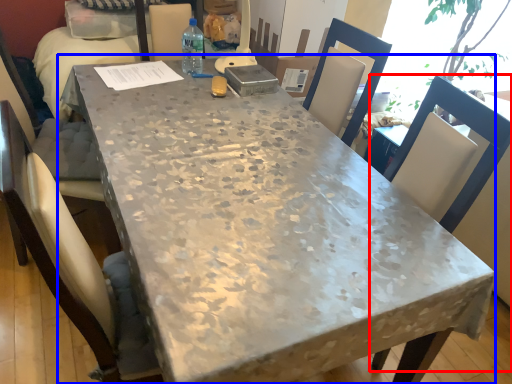
Question: Among these objects, which one is farthest to the camera, chair (highlighted by a red box) or table (highlighted by a blue box)?

Choices:
 (A) chair
 (B) table

Answer: (A)